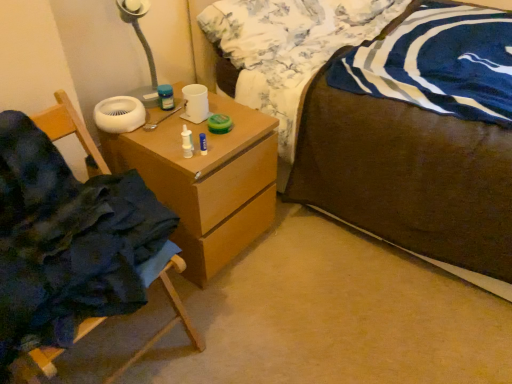
Describe the element at coordinates (419, 153) in the screenshot. This screenshot has width=512, height=384. I see `brown wooden bed at center` at that location.

The image size is (512, 384). Describe the element at coordinates (68, 127) in the screenshot. I see `wooden chair at left` at that location.

The image size is (512, 384). What are the coordinates of `brown wooden bed at center` in the screenshot? It's located at (419, 153).

Is brown wooden bed at center a part of wooden chair at left?

Definitely not — brown wooden bed at center is not inside wooden chair at left.

Considering their positions, is wooden chair at left located in front of or behind brown wooden bed at center?

wooden chair at left is positioned closer to the viewer than brown wooden bed at center.

Are wooden chair at left and brown wooden bed at center far apart?

No, wooden chair at left is not far from brown wooden bed at center.

Which of these two, wooden chair at left or brown wooden bed at center, is bigger?

brown wooden bed at center is bigger.

From a real-world perspective, is fluffy white pillow at upper center physically below brown wooden bed at center?

No.

Does fluffy white pillow at upper center come in front of brown wooden bed at center?

No.

Consider the image. Considering the relative sizes of fluffy white pillow at upper center and brown wooden bed at center in the image provided, is fluffy white pillow at upper center taller than brown wooden bed at center?

In fact, fluffy white pillow at upper center may be shorter than brown wooden bed at center.

How far apart are fluffy white pillow at upper center and brown wooden bed at center?

They are 35.62 centimeters apart.

In terms of width, does fluffy white pillow at upper center look wider or thinner when compared to wooden chair at left?

fluffy white pillow at upper center is thinner than wooden chair at left.

I want to click on pillow above the wooden chair at left (from the image's perspective), so click(258, 27).

Is fluffy white pillow at upper center oriented away from wooden chair at left?

That's not correct — fluffy white pillow at upper center is not looking away from wooden chair at left.

Is fluffy white pillow at upper center to the left of wooden chair at left from the viewer's perspective?

No, fluffy white pillow at upper center is not to the left of wooden chair at left.

Between wooden chest of drawers at center and fluffy white pillow at upper center, which one appears on the right side from the viewer's perspective?

Positioned to the right is fluffy white pillow at upper center.

Which is nearer, [188,201] or [296,20]?

Point [188,201] is positioned closer to the camera compared to point [296,20].

Between wooden chest of drawers at center and fluffy white pillow at upper center, which one has smaller width?

Thinner between the two is fluffy white pillow at upper center.

Which is correct: wooden chest of drawers at center is inside fluffy white pillow at upper center, or outside of it?

wooden chest of drawers at center is not inside fluffy white pillow at upper center, it's outside.

Which is closer, (212, 158) or (36, 354)?

Positioned in front is point (36, 354).

From the image's perspective, which is above, wooden chest of drawers at center or wooden chair at left?

From the image's view, wooden chest of drawers at center is above.

Can you confirm if wooden chest of drawers at center is positioned to the left of wooden chair at left?

Incorrect, wooden chest of drawers at center is not on the left side of wooden chair at left.

Considering the relative positions of wooden chair at left and wooden chest of drawers at center in the image provided, is wooden chair at left to the right of wooden chest of drawers at center from the viewer's perspective?

No.

From a real-world perspective, which is physically above, wooden chair at left or wooden chest of drawers at center?

From a 3D spatial view, wooden chair at left is above.

Can you see wooden chair at left touching wooden chest of drawers at center?

There is a gap between wooden chair at left and wooden chest of drawers at center.

Is wooden chair at left bigger than wooden chest of drawers at center?

Indeed, wooden chair at left has a larger size compared to wooden chest of drawers at center.

Is fluffy white pillow at upper center thinner than wooden chest of drawers at center?

Correct, the width of fluffy white pillow at upper center is less than that of wooden chest of drawers at center.

From a real-world perspective, is fluffy white pillow at upper center above or below wooden chest of drawers at center?

fluffy white pillow at upper center is above wooden chest of drawers at center.

Which of these two, fluffy white pillow at upper center or wooden chest of drawers at center, is smaller?

fluffy white pillow at upper center.

Considering the relative positions of fluffy white pillow at upper center and wooden chest of drawers at center in the image provided, is fluffy white pillow at upper center to the left or to the right of wooden chest of drawers at center?

fluffy white pillow at upper center is to the right of wooden chest of drawers at center.

Locate an element on the screen. Image resolution: width=512 pixels, height=384 pixels. chair lying on the left of brown wooden bed at center is located at coordinates (68, 127).

Where is `bed that appears on the right of fluffy white pillow at upper center`? bed that appears on the right of fluffy white pillow at upper center is located at coordinates (419, 153).

Consider the image. Looking at the image, which one is located further to wooden chest of drawers at center, wooden chair at left or brown wooden bed at center?

brown wooden bed at center lies further to wooden chest of drawers at center than the other object.

Estimate the real-world distances between objects in this image. Which object is further from fluffy white pillow at upper center, wooden chair at left or brown wooden bed at center?

The object further to fluffy white pillow at upper center is wooden chair at left.

In the scene shown: Considering their positions, is brown wooden bed at center positioned closer to wooden chest of drawers at center than wooden chair at left?

Based on the image, wooden chair at left appears to be nearer to wooden chest of drawers at center.

Estimate the real-world distances between objects in this image. Which object is further from wooden chair at left, wooden chest of drawers at center or brown wooden bed at center?

Based on the image, brown wooden bed at center appears to be further to wooden chair at left.

Which object lies further to the anchor point fluffy white pillow at upper center, brown wooden bed at center or wooden chest of drawers at center?

Among the two, wooden chest of drawers at center is located further to fluffy white pillow at upper center.

Consider the image. From the image, which object appears to be nearer to wooden chair at left, wooden chest of drawers at center or fluffy white pillow at upper center?

wooden chest of drawers at center is closer to wooden chair at left.

Considering their positions, is fluffy white pillow at upper center positioned closer to wooden chest of drawers at center than brown wooden bed at center?

brown wooden bed at center is positioned closer to the anchor wooden chest of drawers at center.

Which object lies nearer to the anchor point fluffy white pillow at upper center, brown wooden bed at center or wooden chair at left?

Based on the image, brown wooden bed at center appears to be nearer to fluffy white pillow at upper center.

The width and height of the screenshot is (512, 384). I want to click on pillow between wooden chair at left and brown wooden bed at center, so click(258, 27).

This screenshot has height=384, width=512. Identify the location of chest of drawers between wooden chair at left and brown wooden bed at center. (207, 182).

Where is `chest of drawers between fluffy white pillow at upper center and wooden chair at left from top to bottom`? This screenshot has height=384, width=512. chest of drawers between fluffy white pillow at upper center and wooden chair at left from top to bottom is located at coordinates (207, 182).

The height and width of the screenshot is (384, 512). I want to click on pillow situated between wooden chest of drawers at center and brown wooden bed at center from left to right, so click(x=258, y=27).